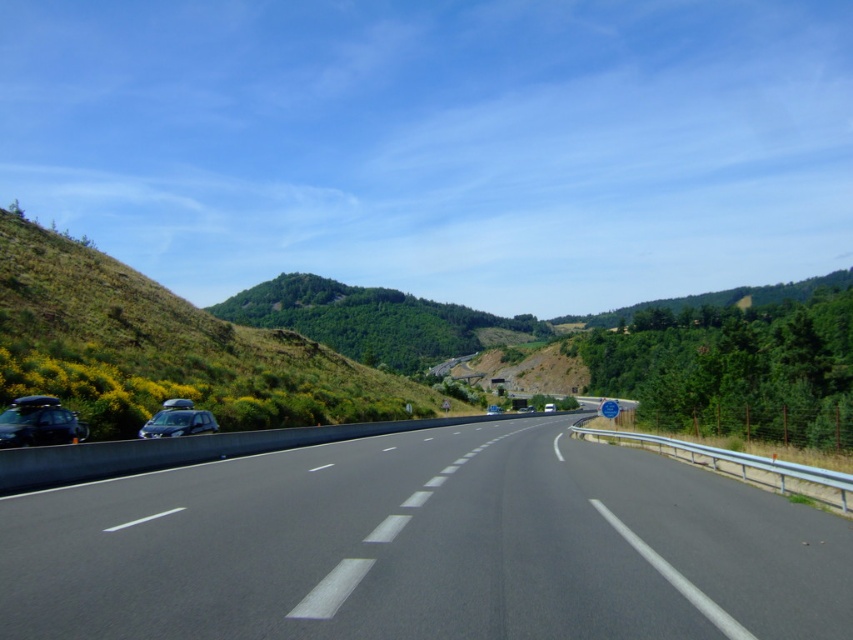
Is shiny black car at left taller than silver metallic van at center?

No.

At what (x,y) coordinates should I click in order to perform the action: click on shiny black car at left. Please return your answer as a coordinate pair (x, y). Image resolution: width=853 pixels, height=640 pixels. Looking at the image, I should click on (39, 422).

Can you confirm if black asphalt highway at center is positioned to the right of silver metallic van at center?

No, black asphalt highway at center is not to the right of silver metallic van at center.

Between black asphalt highway at center and silver metallic van at center, which one appears on the right side from the viewer's perspective?

silver metallic van at center

Is point (471, 554) positioned before point (550, 404)?

Yes, it is in front of point (550, 404).

Identify the location of black asphalt highway at center. Image resolution: width=853 pixels, height=640 pixels. (424, 547).

Consider the image. Is black asphalt highway at center thinner than satin silver car at left?

Incorrect, black asphalt highway at center's width is not less than satin silver car at left's.

Measure the distance between point (541, 600) and camera.

Point (541, 600) and camera are 19.38 feet apart.

Identify the location of black asphalt highway at center. (x=424, y=547).

I want to click on black asphalt highway at center, so click(424, 547).